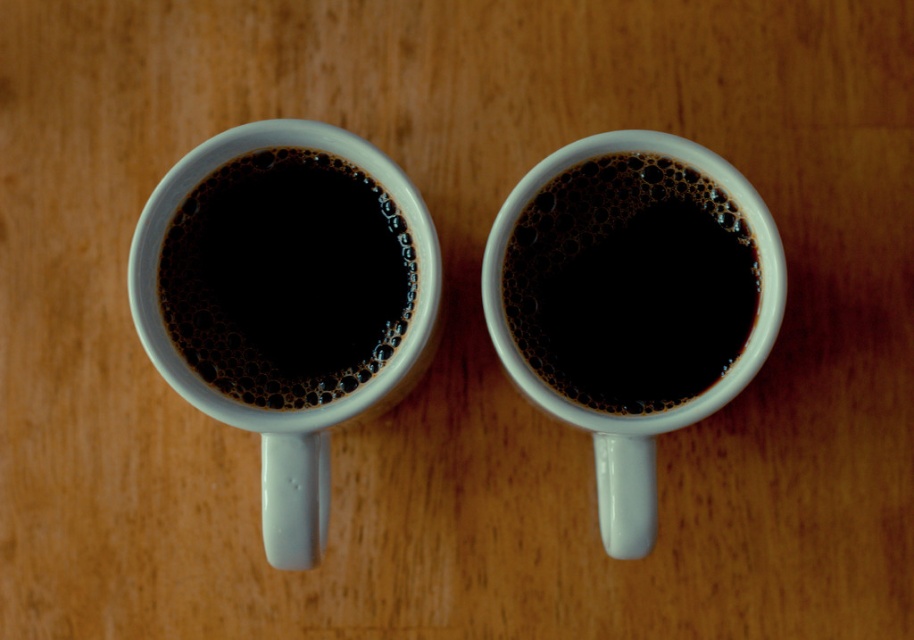
Question: Considering the real-world distances, which object is farthest from the white glossy mug at upper center?

Choices:
 (A) matte ceramic coffee cup at center
 (B) matte ceramic cup at center

Answer: (A)

Question: Among these objects, which one is farthest from the camera?

Choices:
 (A) matte ceramic coffee cup at center
 (B) matte ceramic cup at center
 (C) white glossy mug at upper center

Answer: (B)

Question: Considering the real-world distances, which object is closest to the matte ceramic cup at center?

Choices:
 (A) white glossy mug at upper center
 (B) matte ceramic coffee cup at center

Answer: (A)

Question: Does matte ceramic cup at center come behind matte ceramic coffee cup at center?

Choices:
 (A) yes
 (B) no

Answer: (A)

Question: Is white glossy mug at upper center wider than matte ceramic coffee cup at center?

Choices:
 (A) yes
 (B) no

Answer: (A)

Question: Can you confirm if white glossy mug at upper center is positioned below matte ceramic cup at center?

Choices:
 (A) no
 (B) yes

Answer: (B)